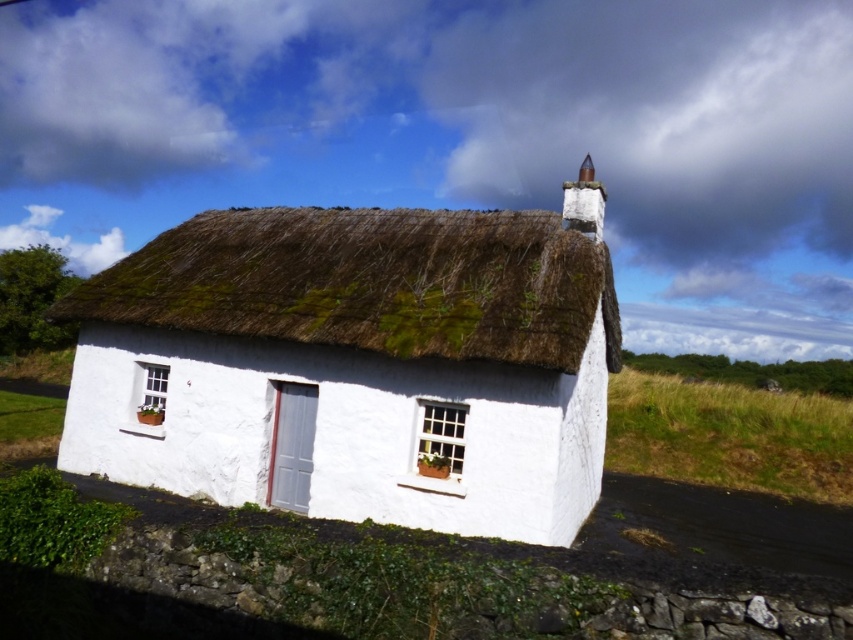
Question: Does white thatch roof at center have a smaller size compared to green thatch at center?

Choices:
 (A) yes
 (B) no

Answer: (B)

Question: Which of the following is the farthest from the observer?

Choices:
 (A) green thatch at center
 (B) white thatch roof at center

Answer: (B)

Question: Does white thatch roof at center have a smaller size compared to green thatch at center?

Choices:
 (A) yes
 (B) no

Answer: (B)

Question: From the image, what is the correct spatial relationship of white thatch roof at center in relation to green thatch at center?

Choices:
 (A) below
 (B) above

Answer: (A)